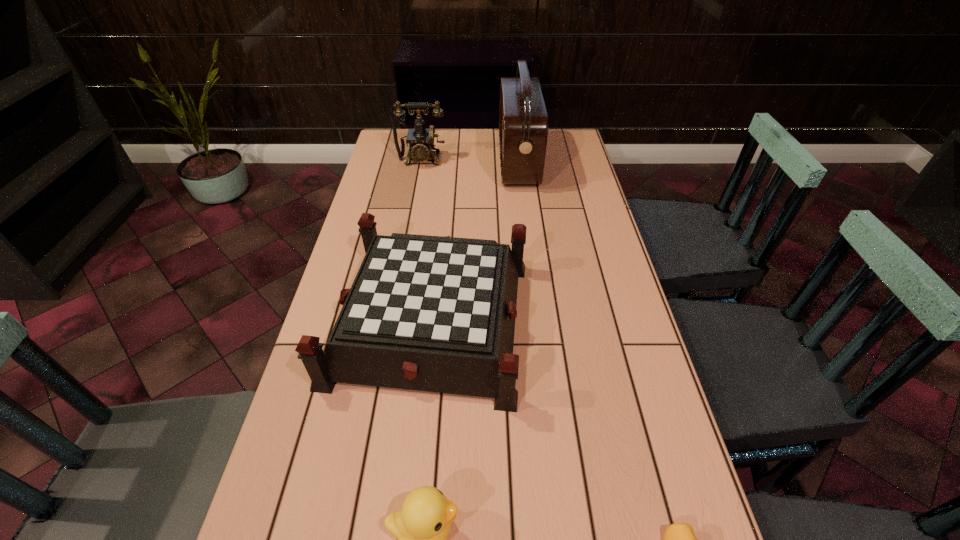
At what (x,y) coordinates should I click in order to perform the action: click on telephone that is positioned at the far edge. Please return your answer as a coordinate pair (x, y). Looking at the image, I should click on (420, 140).

At what (x,y) coordinates should I click in order to perform the action: click on telephone positioned at the left edge. Please return your answer as a coordinate pair (x, y). The height and width of the screenshot is (540, 960). Looking at the image, I should click on (420, 140).

Image resolution: width=960 pixels, height=540 pixels. I want to click on checkerboard at the left edge, so click(429, 313).

Locate an element on the screen. object that is at the far left corner is located at coordinates (420, 140).

Identify the location of vacant space at the far edge of the desktop. (468, 130).

Where is `vacant point at the left edge`? The height and width of the screenshot is (540, 960). vacant point at the left edge is located at coordinates (311, 437).

You are a GUI agent. You are given a task and a screenshot of the screen. Output one action in this format:
    pyautogui.click(x=<x>, y=<y>)
    Task: Click on the free point at the right edge
    This screenshot has height=540, width=960.
    Given the screenshot: What is the action you would take?
    pyautogui.click(x=630, y=371)

The image size is (960, 540). Find the location of `vacant region at the far right corner`. vacant region at the far right corner is located at coordinates pyautogui.click(x=577, y=137).

I want to click on empty space that is in between the second tallest object and the radio receiver, so click(x=469, y=161).

This screenshot has height=540, width=960. I want to click on free space that is in between the tallest object and the second tallest object, so click(469, 161).